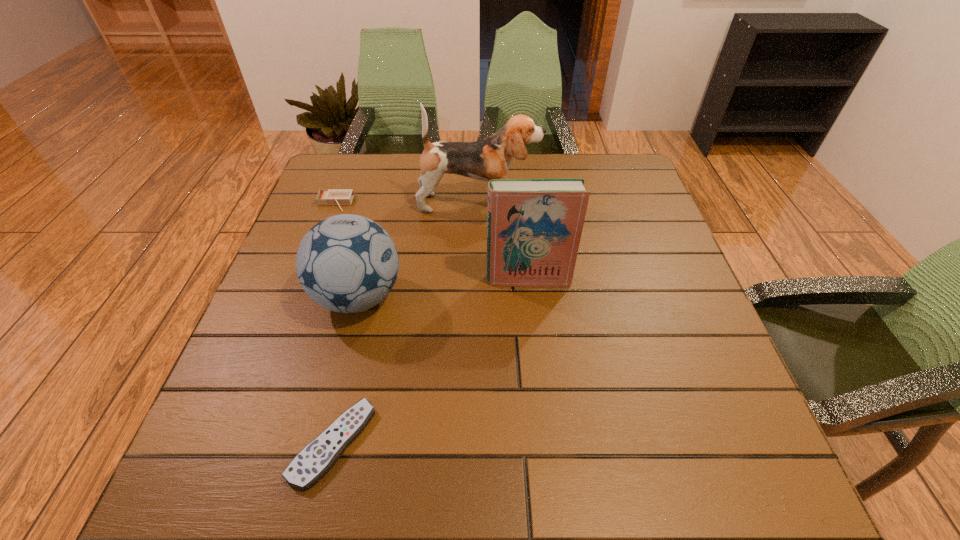
At what (x,y) coordinates should I click in order to perform the action: click on unoccupied area between the hardback book and the nearest object. Please return your answer as a coordinate pair (x, y). Looking at the image, I should click on (431, 361).

Identify the location of empty space between the puppy and the soccer ball. This screenshot has height=540, width=960. (419, 250).

Locate an element on the screen. object that is the third closest to the remote control is located at coordinates (490, 158).

Identify which object is the fourth nearest to the matchbox. Please provide its 2D coordinates. Your answer should be formatted as a tuple, i.e. [(x, y)], where the tuple contains the x and y coordinates of a point satisfying the conditions above.

[(316, 458)]

Locate an element on the screen. The height and width of the screenshot is (540, 960). free space in the image that satisfies the following two spatial constraints: 1. at the face of the puppy; 2. on the striking surface of the fourth tallest object is located at coordinates (478, 203).

Where is `blank area in the image that satisfies the following two spatial constraints: 1. on the side with brand of the nearest object; 2. on the left side of the third shortest object`? This screenshot has width=960, height=540. blank area in the image that satisfies the following two spatial constraints: 1. on the side with brand of the nearest object; 2. on the left side of the third shortest object is located at coordinates (321, 443).

This screenshot has width=960, height=540. What are the coordinates of `vacant space that satisfies the following two spatial constraints: 1. on the side with brand of the soccer ball; 2. on the back side of the shortest object` in the screenshot? It's located at (321, 443).

What are the coordinates of `free region that satisfies the following two spatial constraints: 1. at the face of the puppy; 2. on the striking surface of the fourth tallest object` in the screenshot? It's located at (478, 203).

The width and height of the screenshot is (960, 540). What are the coordinates of `free space in the image that satisfies the following two spatial constraints: 1. on the cover of the hardback book; 2. on the side with brand of the third shortest object` in the screenshot? It's located at (530, 297).

Where is `vacant region that satisfies the following two spatial constraints: 1. on the striking surface of the remote control; 2. on the right side of the second shortest object`? vacant region that satisfies the following two spatial constraints: 1. on the striking surface of the remote control; 2. on the right side of the second shortest object is located at coordinates (244, 443).